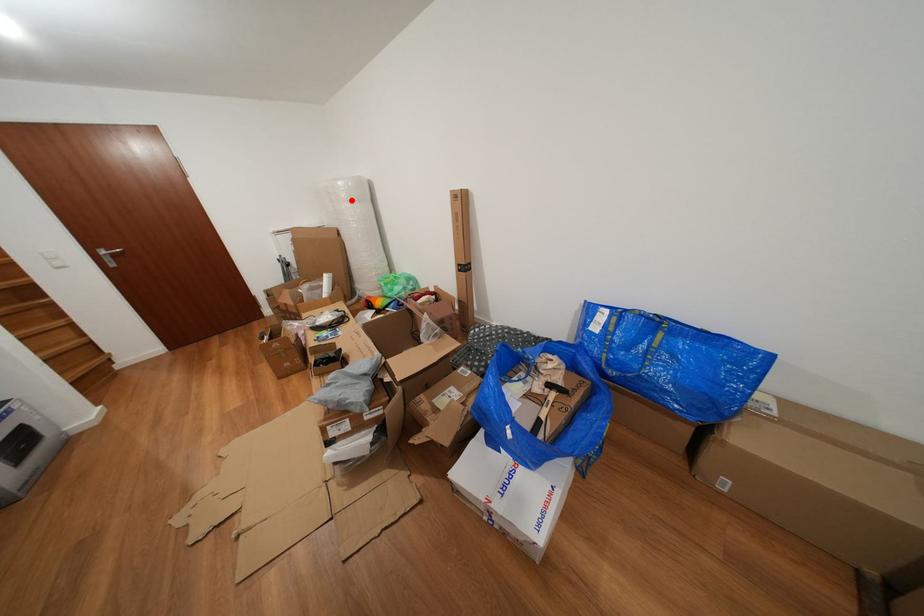
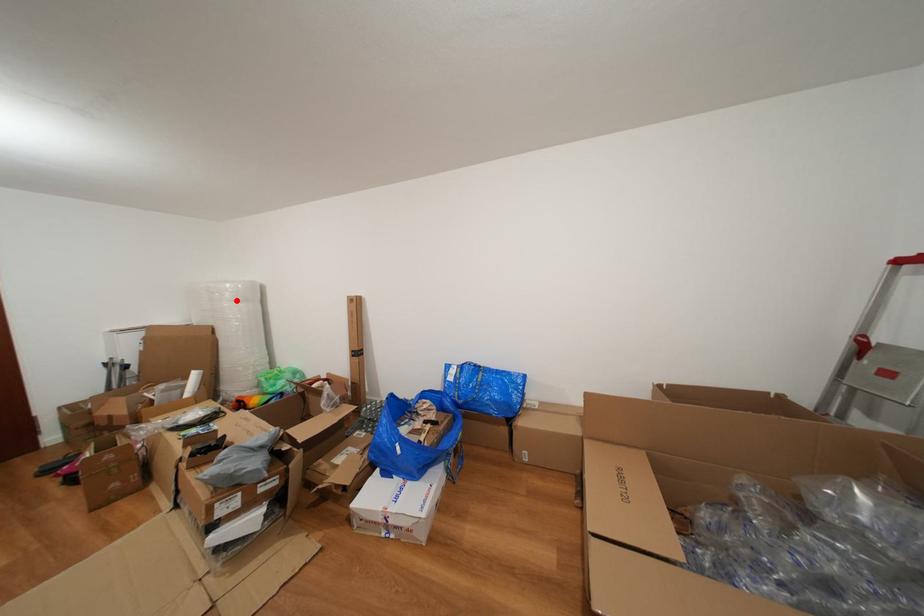
I am providing you with two images of the same scene from different viewpoints. A red point is marked on the first image and another point is marked on the second image. Is the marked point in image1 the same physical position as the marked point in image2?

Yes